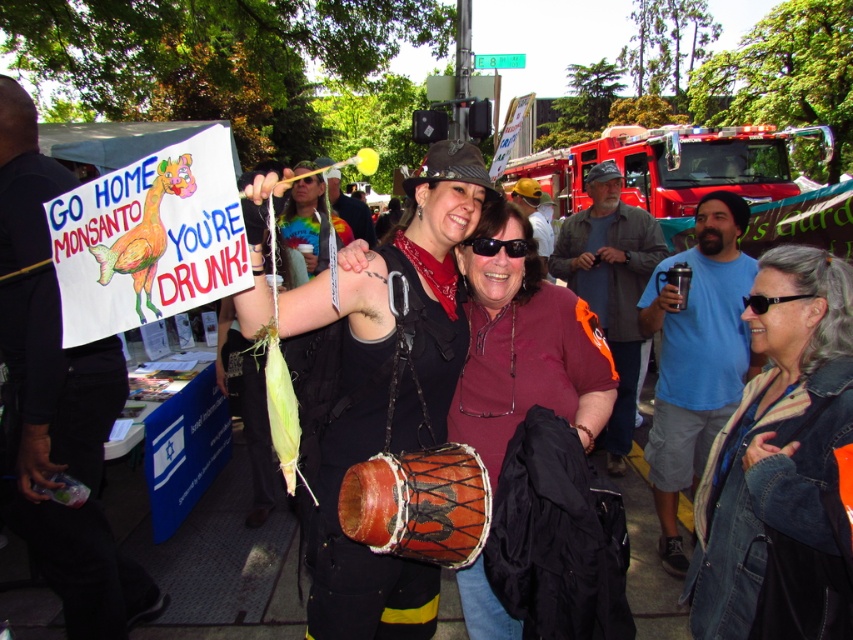
You are organizing a street performance and need to decide which item to place first in your cart. Given their sizes, which object should you place first between the leather drum at center and the gray fabric jacket at center?

The leather drum at center has a smaller size compared to the gray fabric jacket at center, so you should place the gray fabric jacket at center first to make space for the smaller item.